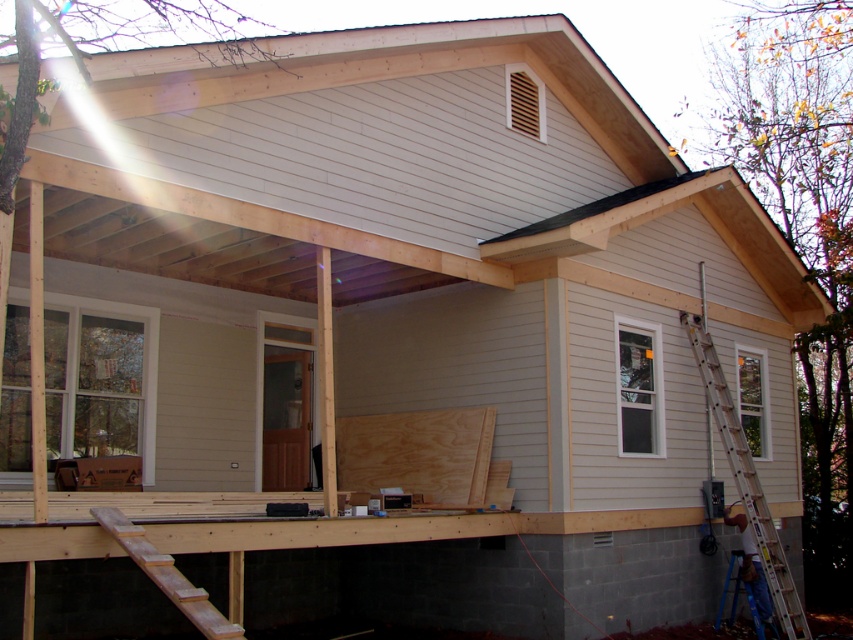
You are a construction worker needing to reach the roof for repairs. You see a blue metallic ladder at right and a wooden ladder at lower left. Which ladder should you choose to safely reach the roof?

The blue metallic ladder at right has a greater height compared to the wooden ladder at lower left, so you should choose the blue metallic ladder at right to safely reach the roof.

You are standing in front of the residential building under construction. You notice two points marked on the structure. The first point is at coordinates point (785, 624) and the second is at point (120, 531). Which point is closer to you?

Point (120, 531) is closer to you because it is less further to the camera than point (785, 624).

You are a construction worker who needs to access the roof for repairs. You see the blue metallic ladder at right. Is the ladder positioned near the gabled roof area where you need to work?

The blue metallic ladder at right is located at point (746,481), which is near the gabled roof area where you need to work.